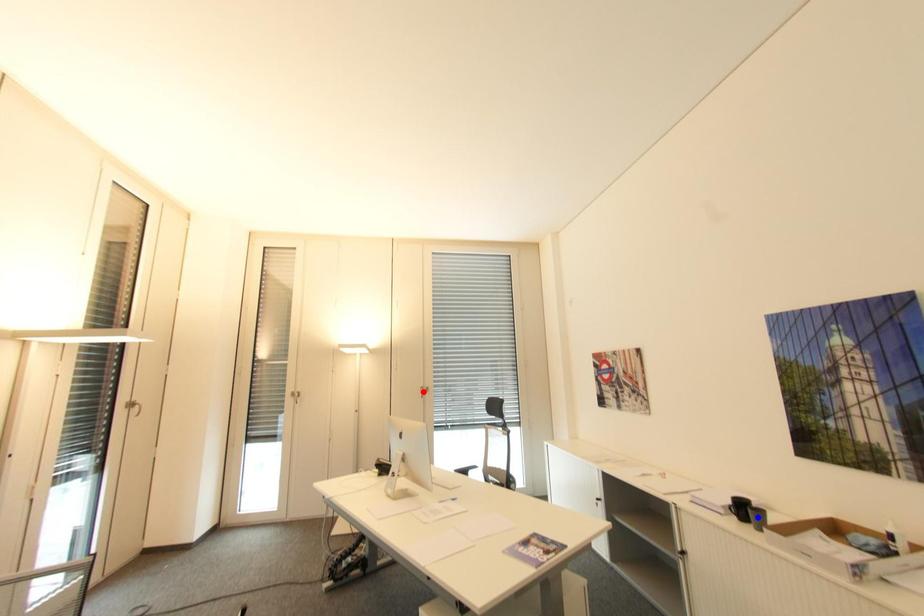
Question: Which of the two points in the image is closer to the camera?

Choices:
 (A) Blue point is closer.
 (B) Red point is closer.

Answer: (A)